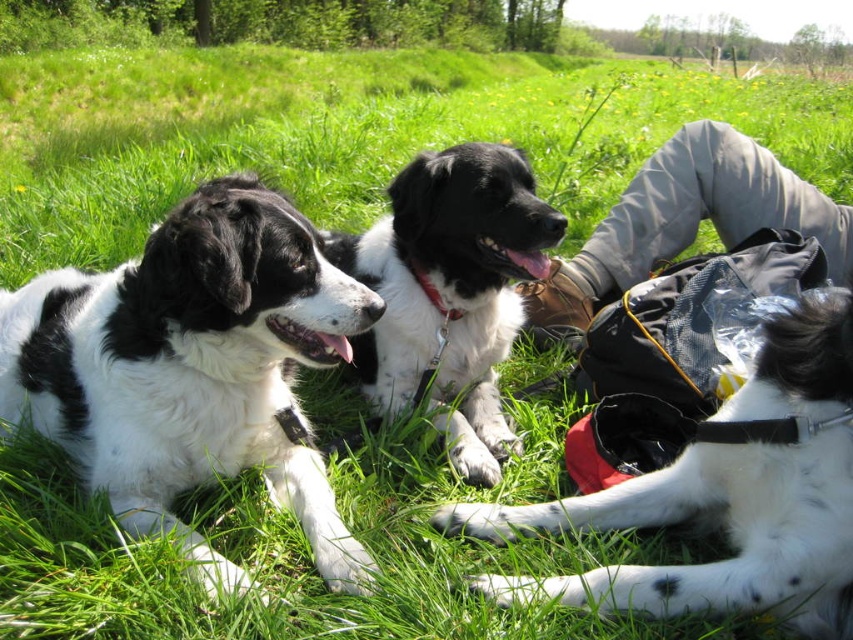
Can you confirm if black and white fur at left is positioned to the left of black/white fur dog at center?

Indeed, black and white fur at left is positioned on the left side of black/white fur dog at center.

Between black and white fur at left and black/white fur dog at center, which one is positioned higher?

black/white fur dog at center is higher up.

Who is more distant from viewer, (117, 307) or (456, 244)?

The point (456, 244) is behind.

Identify the location of black and white fur at left. (193, 369).

Can you confirm if black and white fur at left is positioned to the right of white-spotted fur dog at center?

In fact, black and white fur at left is to the left of white-spotted fur dog at center.

Is point (252, 301) positioned in front of point (767, 557)?

No, it is behind (767, 557).

Locate an element on the screen. The width and height of the screenshot is (853, 640). black and white fur at left is located at coordinates (193, 369).

The image size is (853, 640). I want to click on white-spotted fur dog at center, so click(726, 497).

Who is lower down, white-spotted fur dog at center or black/white fur dog at center?

white-spotted fur dog at center is below.

The width and height of the screenshot is (853, 640). In order to click on white-spotted fur dog at center in this screenshot , I will do `click(726, 497)`.